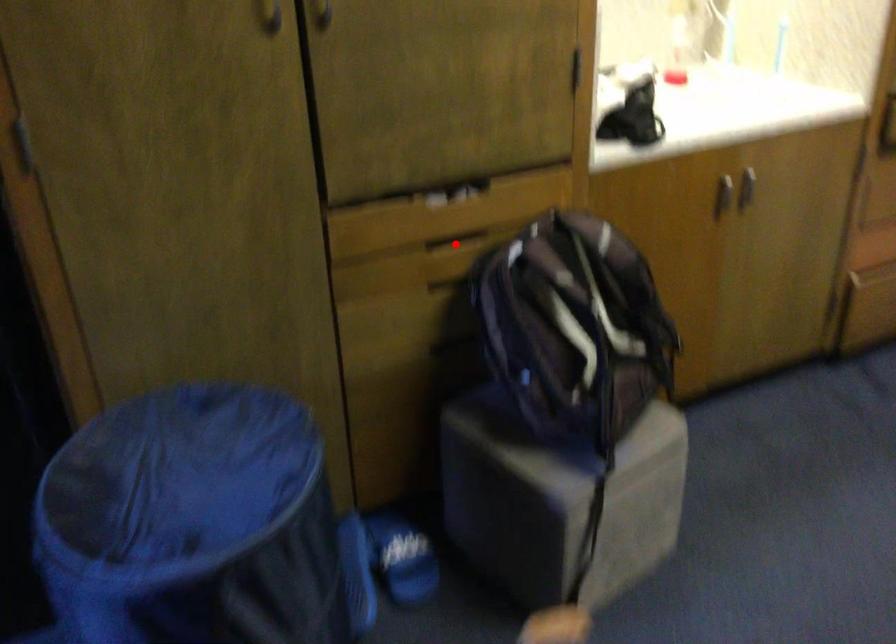
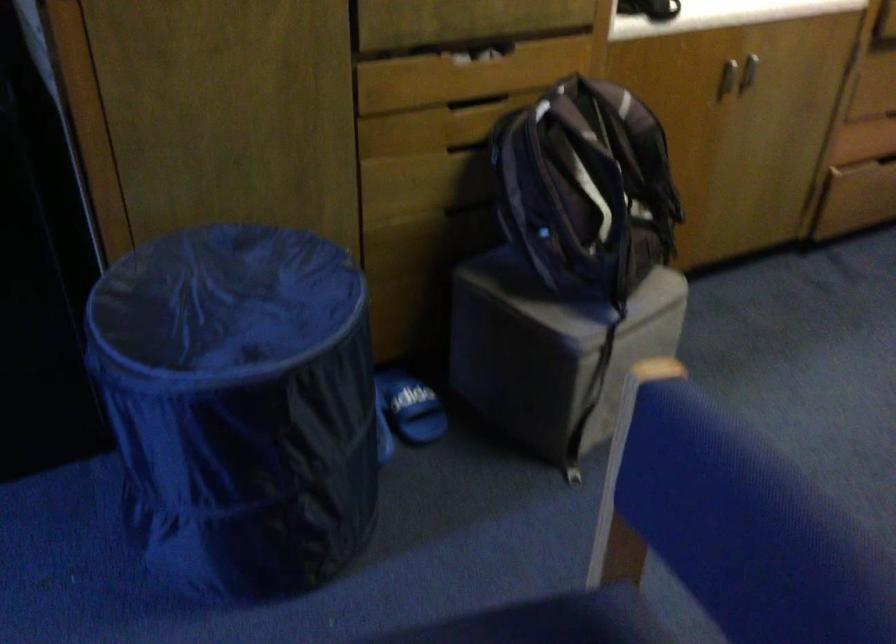
Find the pixel in the second image that matches the highlighted location in the first image.

(476, 102)